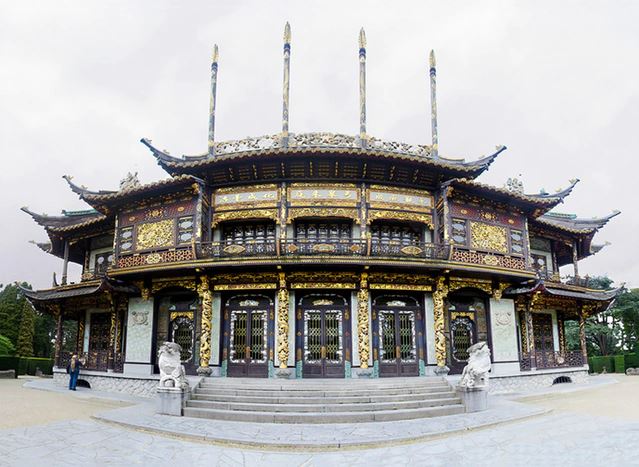
Find the location of a particular element. statue is located at coordinates (479, 360), (165, 362).